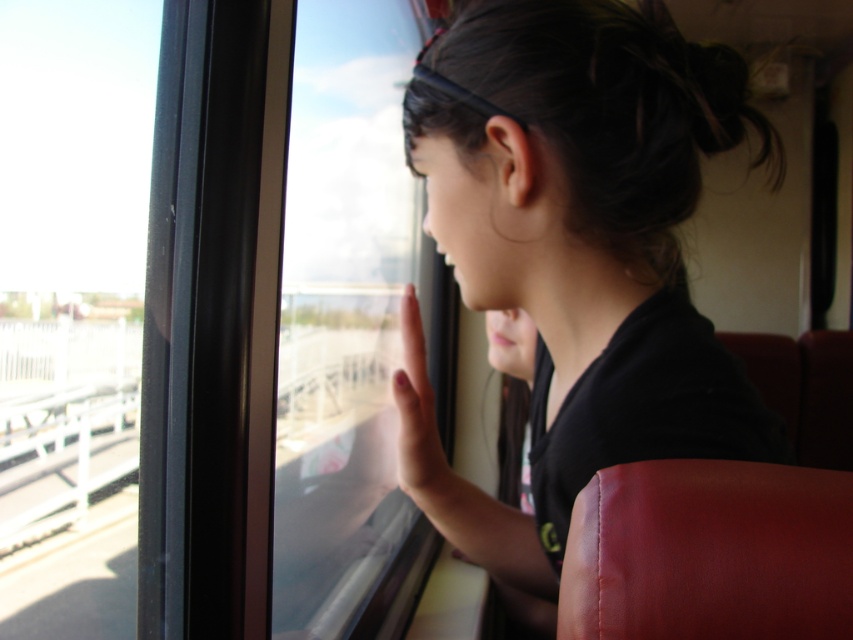
Does point (86, 456) come closer to viewer compared to point (404, 204)?

No, it is behind (404, 204).

Is transparent glass train window at left wider than transparent glass window at center?

Yes.

Is point (135, 88) farther from camera compared to point (431, 548)?

Yes, point (135, 88) is behind point (431, 548).

Locate an element on the screen. This screenshot has height=640, width=853. transparent glass train window at left is located at coordinates (71, 308).

Can you confirm if transparent glass window at center is shorter than pink flesh at window?

Incorrect, transparent glass window at center's height does not fall short of pink flesh at window's.

Between transparent glass window at center and pink flesh at window, which one is positioned higher?

transparent glass window at center

Is point (381, 618) closer to camera compared to point (410, 292)?

No, it is not.

You are a GUI agent. You are given a task and a screenshot of the screen. Output one action in this format:
    pyautogui.click(x=<x>, y=<y>)
    Task: Click on the transparent glass window at center
    The height and width of the screenshot is (640, 853).
    Given the screenshot: What is the action you would take?
    pyautogui.click(x=351, y=330)

What are the coordinates of `black matte hair at upper center` in the screenshot? It's located at click(x=575, y=252).

Is black matte hair at upper center behind transparent glass train window at left?

No.

Between point (514, 90) and point (10, 456), which one is positioned behind?

Point (10, 456)

What are the coordinates of `black matte hair at upper center` in the screenshot? It's located at (575, 252).